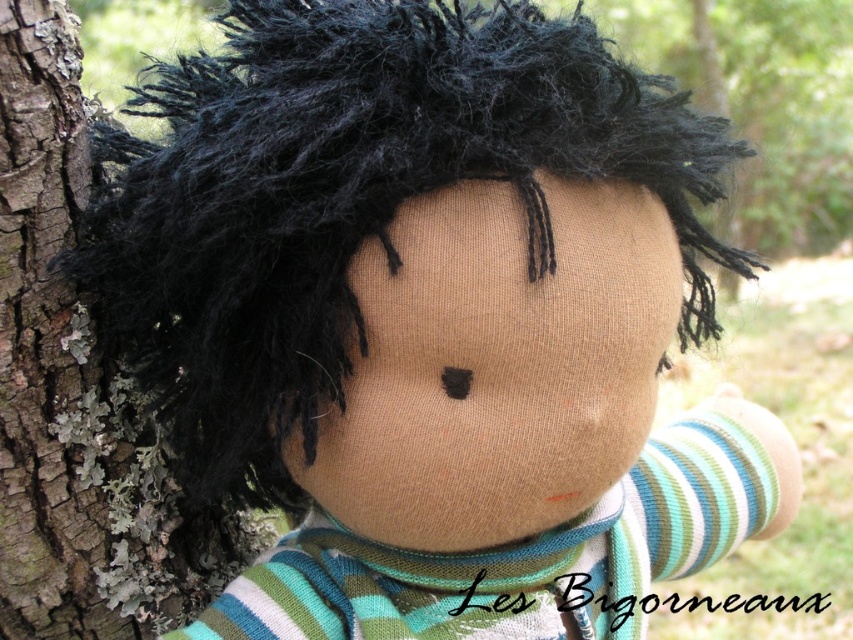
Where is the black fuzzy hair at center located in the image?

The black fuzzy hair at center is located at point (350,198).

You are a small insect crawling on the rough bark tree trunk at left. You want to reach the black fuzzy hair at center to rest. Considering their sizes, which object would you find easier to climb?

The rough bark tree trunk at left has a smaller size compared to the black fuzzy hair at center, so the insect would find it easier to climb the rough bark tree trunk at left due to its smaller size.